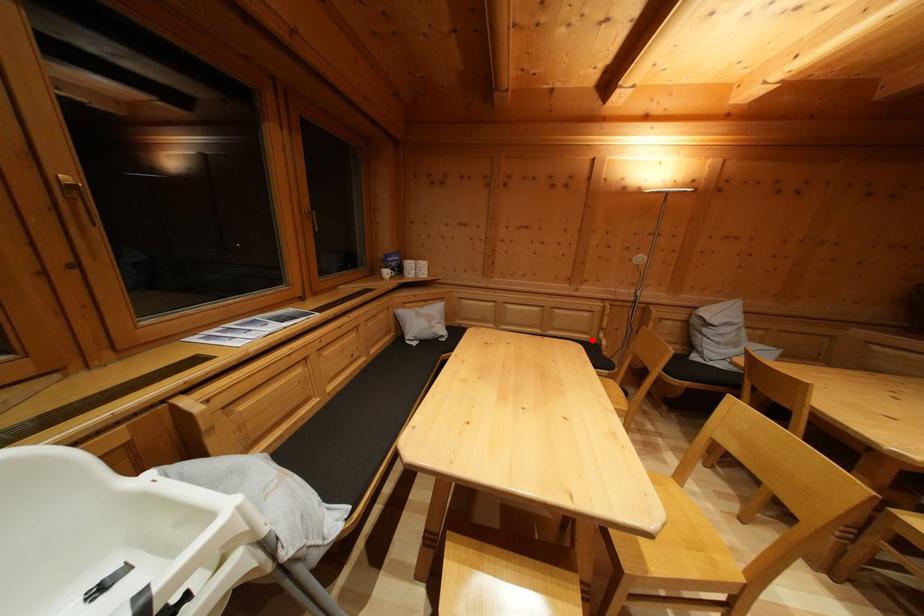
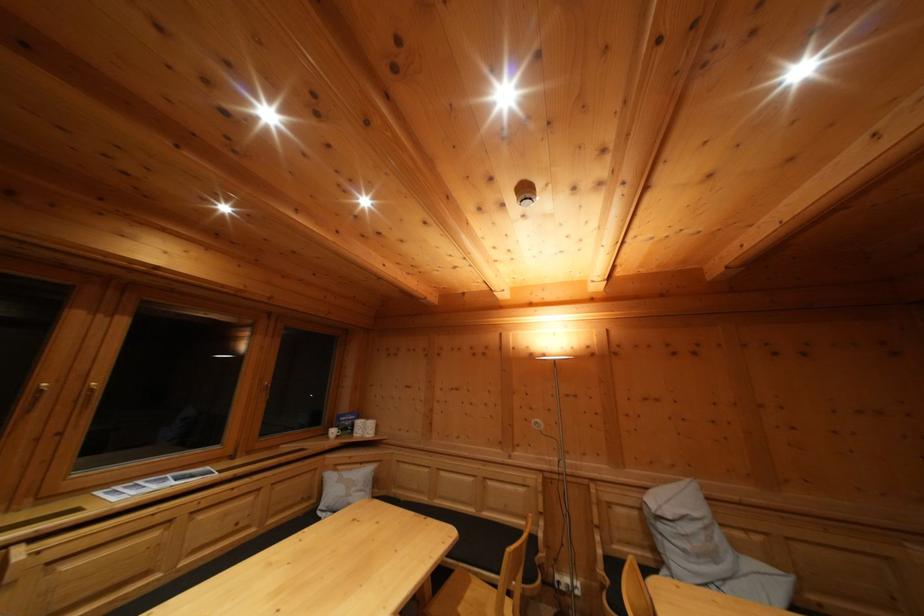
Question: I am providing you with two images of the same scene from different viewpoints. Image1 has a red point marked. In image2, the corresponding 3D location appears at what relative position? Reply with the corresponding letter.

Choices:
 (A) Closer
 (B) Farther

Answer: (B)